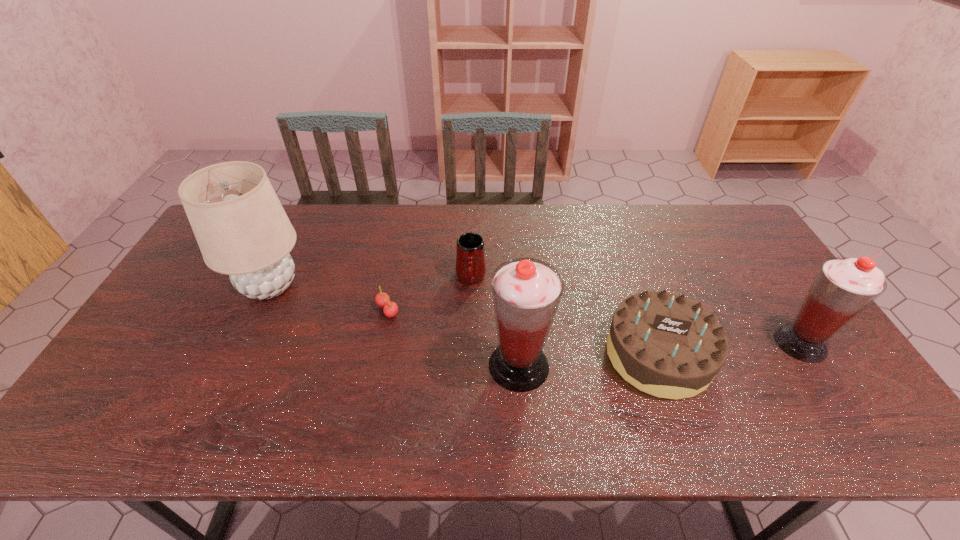
Find the location of a particular element. The image size is (960, 540). the taller smoothie is located at coordinates (526, 292).

The height and width of the screenshot is (540, 960). I want to click on the third object from right to left, so click(526, 292).

Where is `the right smoothie`? The image size is (960, 540). the right smoothie is located at coordinates (843, 287).

What are the coordinates of `the fourth shortest object` in the screenshot? It's located at (843, 287).

The image size is (960, 540). In order to click on lampshade in this screenshot , I will do `click(242, 230)`.

Where is `the fifth object from right to left`? The width and height of the screenshot is (960, 540). the fifth object from right to left is located at coordinates (390, 309).

Find the location of a particular element. the shortest object is located at coordinates (390, 309).

At what (x,y) coordinates should I click in order to perform the action: click on mug. Please return your answer as a coordinate pair (x, y). The height and width of the screenshot is (540, 960). Looking at the image, I should click on (470, 253).

The height and width of the screenshot is (540, 960). What are the coordinates of `the fifth object from left to right` in the screenshot? It's located at (666, 345).

Identify the location of free spot located on the back of the left smoothie. This screenshot has height=540, width=960. pos(516,327).